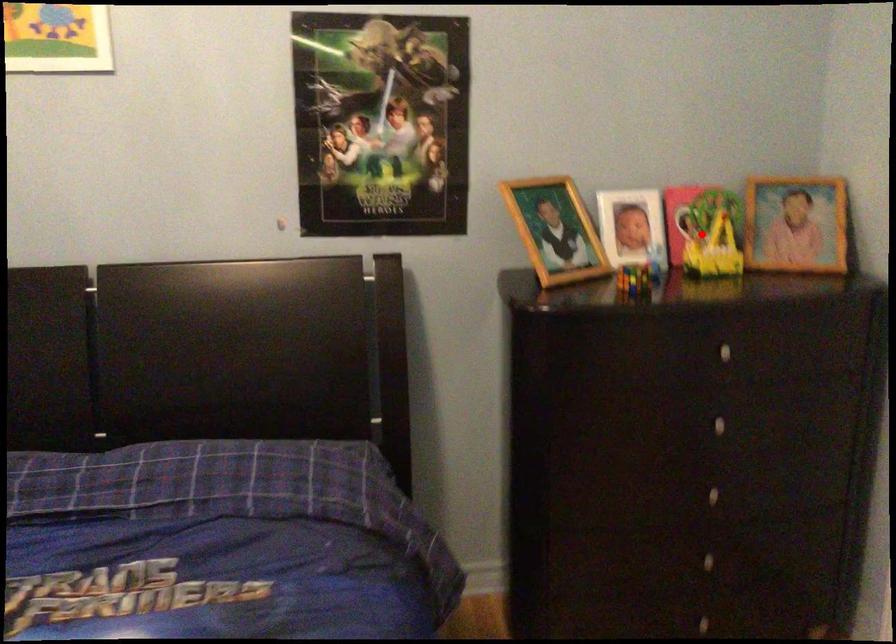
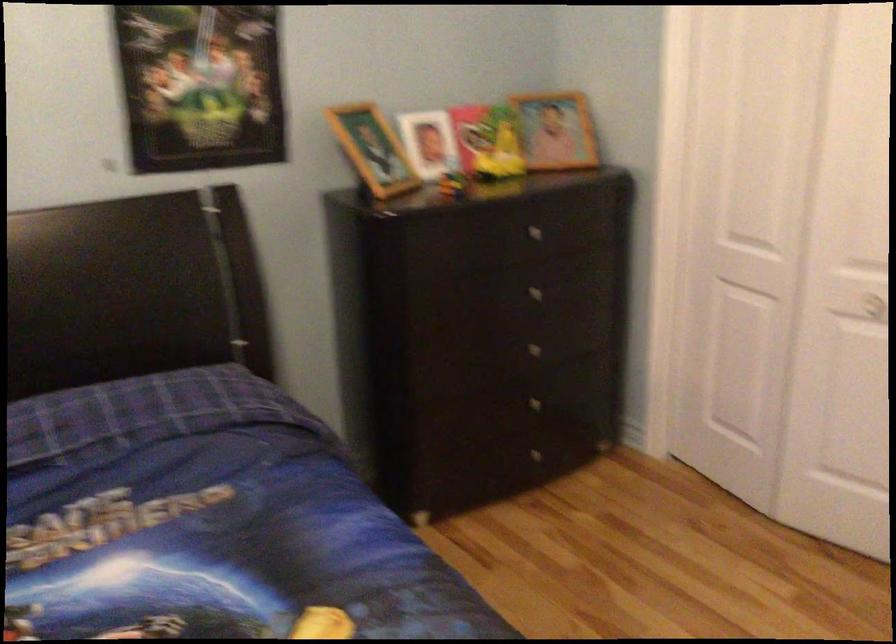
Where in the second image is the point corresponding to the highlighted location from the first image?

(487, 142)